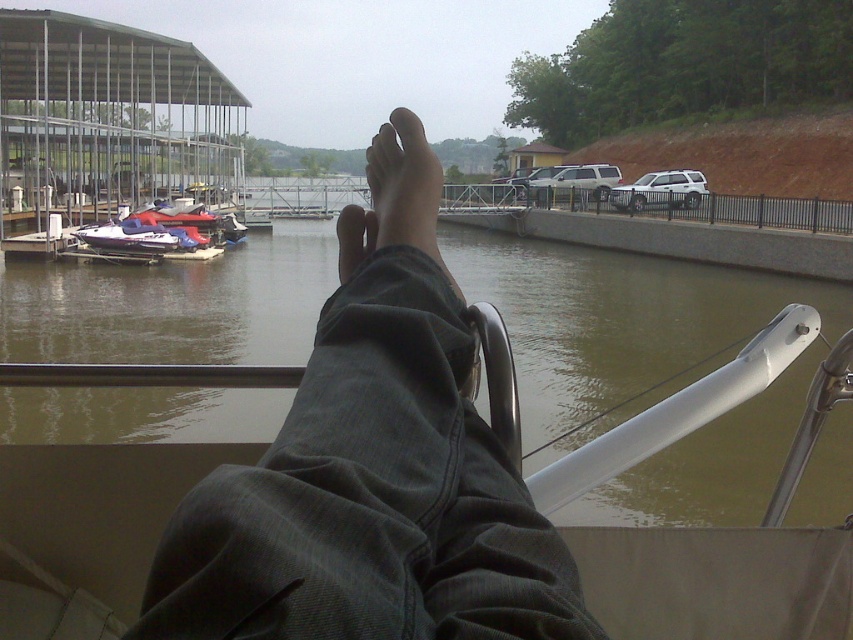
Is skinny barefoot at center shorter than blue and white plastic boat at left?

Correct, skinny barefoot at center is not as tall as blue and white plastic boat at left.

Does skinny barefoot at center appear on the right side of blue and white plastic boat at left?

Yes, skinny barefoot at center is to the right of blue and white plastic boat at left.

Where is `skinny barefoot at center`? The height and width of the screenshot is (640, 853). skinny barefoot at center is located at coordinates tap(404, 184).

Who is more forward, (463, 609) or (70, 323)?

Point (463, 609) is more forward.

Measure the distance between jeans at center and camera.

The distance of jeans at center from camera is 18.99 inches.

Which is in front, point (242, 588) or point (639, 304)?

Positioned in front is point (242, 588).

At what (x,y) coordinates should I click in order to perform the action: click on jeans at center. Please return your answer as a coordinate pair (x, y). Looking at the image, I should click on (370, 497).

This screenshot has height=640, width=853. Describe the element at coordinates (158, 234) in the screenshot. I see `blue and white plastic boat at left` at that location.

Which is more to the right, blue and white plastic boat at left or matte black foot at center?

From the viewer's perspective, matte black foot at center appears more on the right side.

Locate an element on the screen. Image resolution: width=853 pixels, height=640 pixels. blue and white plastic boat at left is located at coordinates (158, 234).